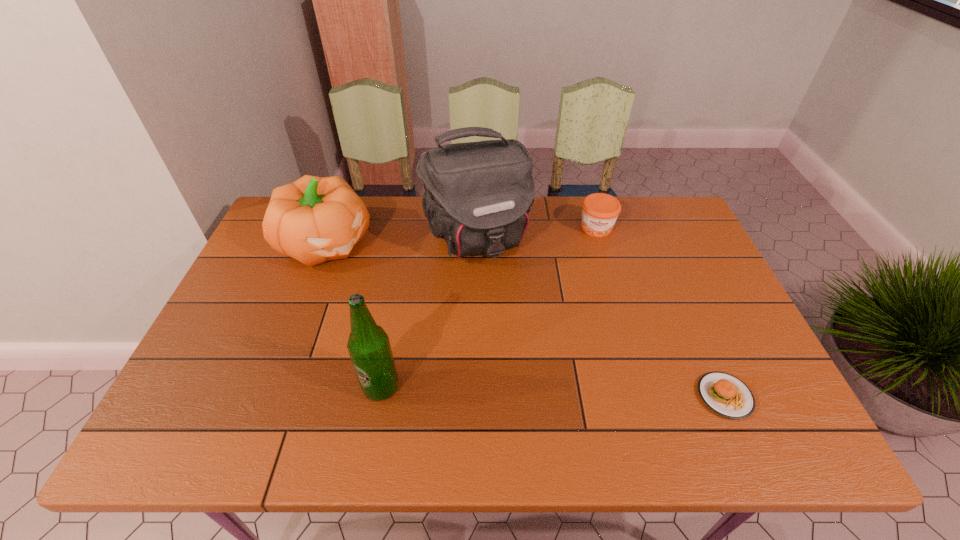
Identify the location of the second object from left to right. Image resolution: width=960 pixels, height=540 pixels. (368, 345).

You are a GUI agent. You are given a task and a screenshot of the screen. Output one action in this format:
    pyautogui.click(x=<x>, y=<y>)
    Task: Click on the fourth shortest object
    Image resolution: width=960 pixels, height=540 pixels.
    Given the screenshot: What is the action you would take?
    pyautogui.click(x=368, y=345)

Identify the location of the rightmost object. (726, 395).

The height and width of the screenshot is (540, 960). I want to click on food, so click(726, 395).

Locate an element on the screen. jam is located at coordinates (600, 211).

At what (x,y) coordinates should I click in order to perform the action: click on the fourth object from left to right. Please return your answer as a coordinate pair (x, y). Looking at the image, I should click on (600, 211).

This screenshot has width=960, height=540. In order to click on the third object from right to left in this screenshot , I will do `click(477, 197)`.

Where is `shoulder bag`? shoulder bag is located at coordinates (477, 197).

Locate an element on the screen. The image size is (960, 540). pumpkin is located at coordinates (314, 219).

Where is `the leftmost object`? the leftmost object is located at coordinates (314, 219).